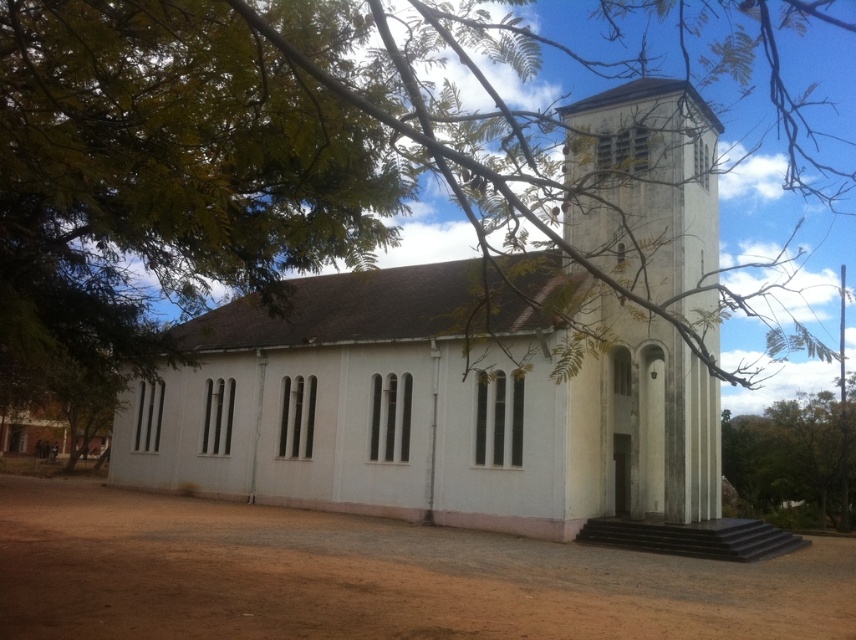
Question: Is brown dirt field at lower left to the right of green leafy tree at lower right from the viewer's perspective?

Choices:
 (A) no
 (B) yes

Answer: (A)

Question: Among these points, which one is nearest to the camera?

Choices:
 (A) (608, 484)
 (B) (819, 449)

Answer: (A)

Question: Does brown dirt field at lower left appear under green leafy tree at lower right?

Choices:
 (A) no
 (B) yes

Answer: (A)

Question: Which object is closer to the camera taking this photo?

Choices:
 (A) green leafy tree at lower right
 (B) brown dirt field at lower left
 (C) white concrete church at center

Answer: (C)

Question: Does white concrete church at center appear over brown dirt field at lower left?

Choices:
 (A) yes
 (B) no

Answer: (A)

Question: Which point is closer to the camera taking this photo?

Choices:
 (A) (470, 435)
 (B) (842, 502)
 (C) (143, 532)

Answer: (C)